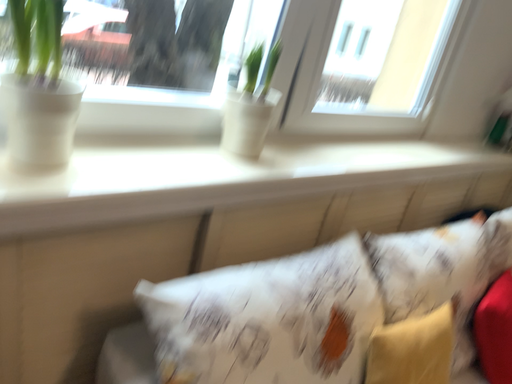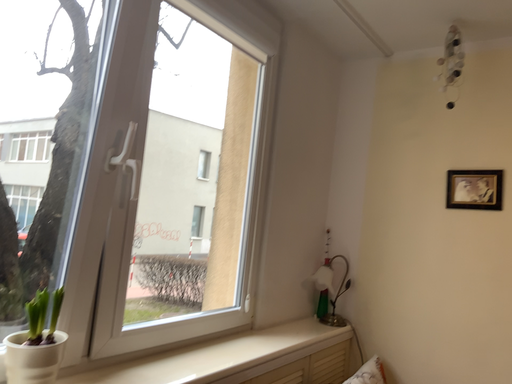
Question: How did the camera likely rotate when shooting the video?

Choices:
 (A) rotated left
 (B) rotated right

Answer: (B)